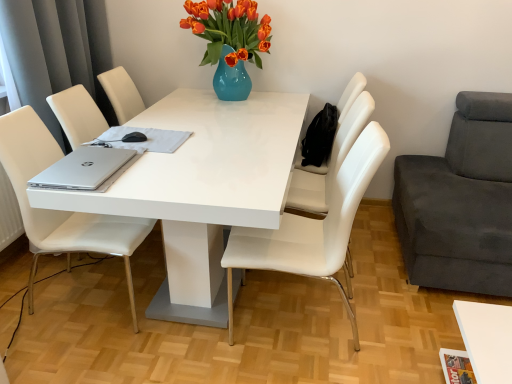
You are a GUI agent. You are given a task and a screenshot of the screen. Output one action in this format:
    pyautogui.click(x=<x>, y=<y>)
    Task: Click on the vacant area that lies to the right of white leather chair at center, placed as the 2th chair when sorted from right to left
    
    Given the screenshot: What is the action you would take?
    pyautogui.click(x=382, y=262)